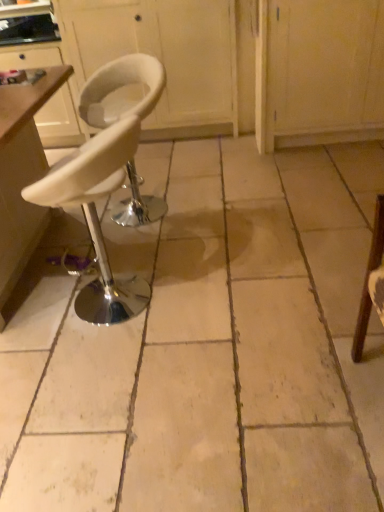
Where is `free space above white leather stool at center (from a real-world perspective)`? free space above white leather stool at center (from a real-world perspective) is located at coordinates (205, 242).